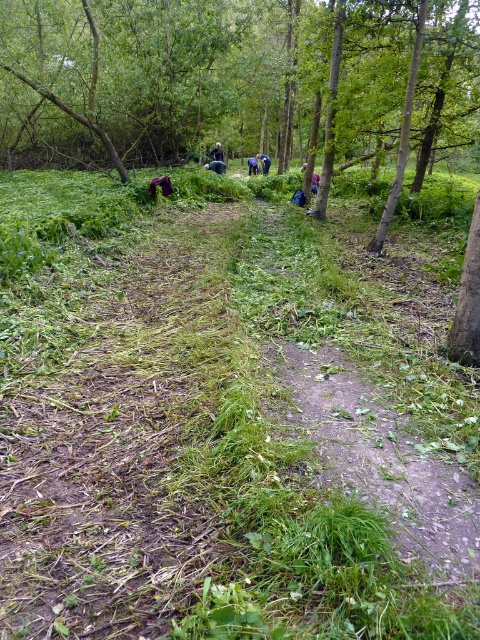
You are a hiker who wants to take a photo of the dark brown leather jacket at center and dark blue shirt at center from above. Which object should you focus on to ensure both are in frame without moving the camera?

You should focus on the dark brown leather jacket at center because it is taller than the dark blue shirt at center, ensuring both will be visible in the frame when centered.

You are a hiker standing at the starting point of the forest path. You notice two marked points in the scene, one at coordinates point (199, 189) and another at point (432, 497). Which of these points is closer to your current position?

Point (199, 189) is closer to your current position because it is further to the camera than point (432, 497), meaning it is nearer to the observer.

You are a hiker carrying a backpack and need to pass between the green leafy tree at center and the nearest tree to its right. The path between them is narrow. How much space do you have to navigate through?

The path between the green leafy tree at center and the nearest tree to its right is 23.40 feet wide, providing ample space for the hiker to pass through safely.